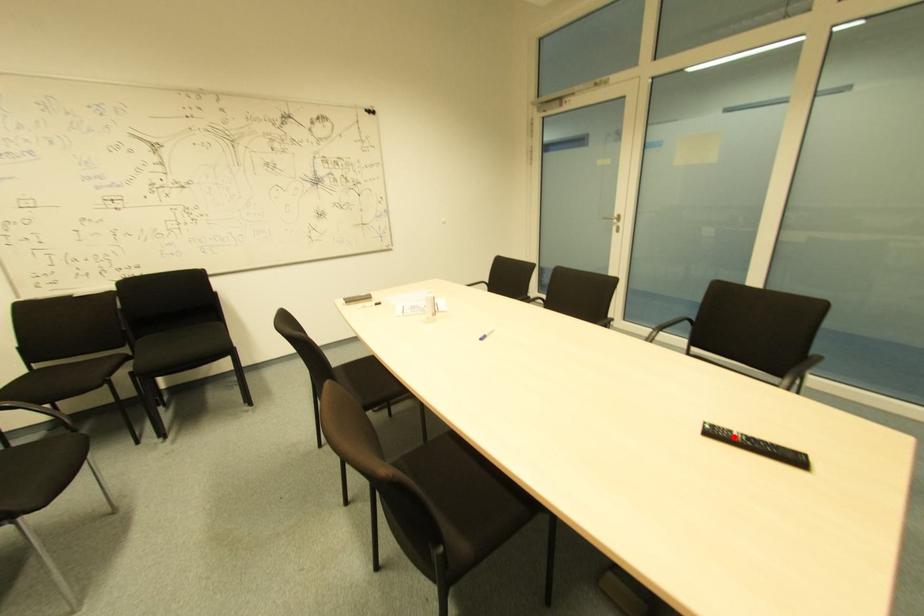
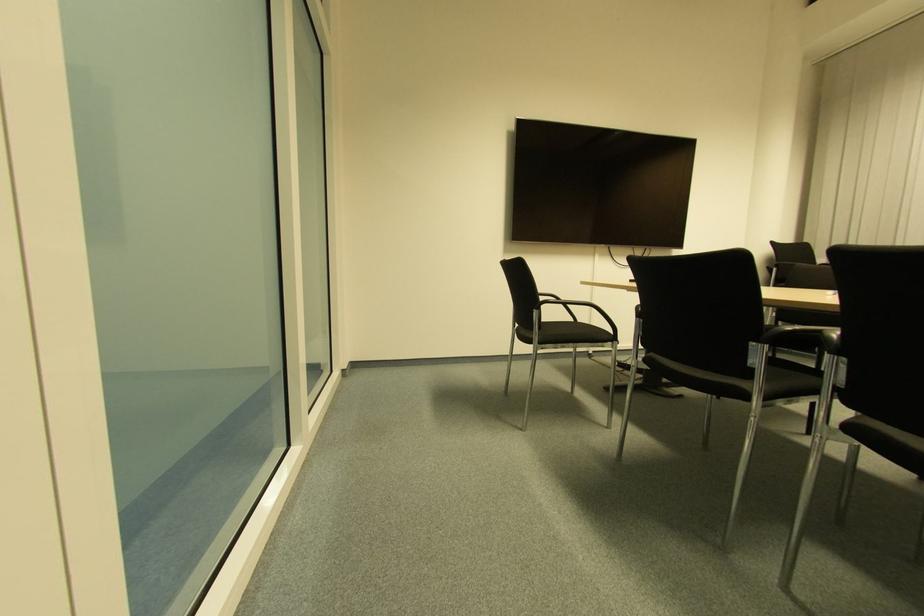
Question: I am providing you with two images of the same scene from different viewpoints. A red point is marked on the first image. Can you still see the location of the red point in image 2?

Choices:
 (A) Yes
 (B) No

Answer: (B)